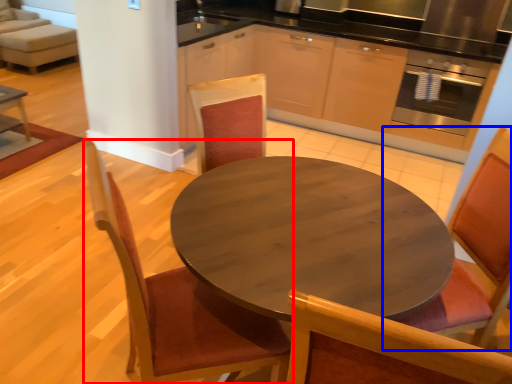
Question: Which point is further to the camera, chair (highlighted by a red box) or chair (highlighted by a blue box)?

Choices:
 (A) chair
 (B) chair

Answer: (B)